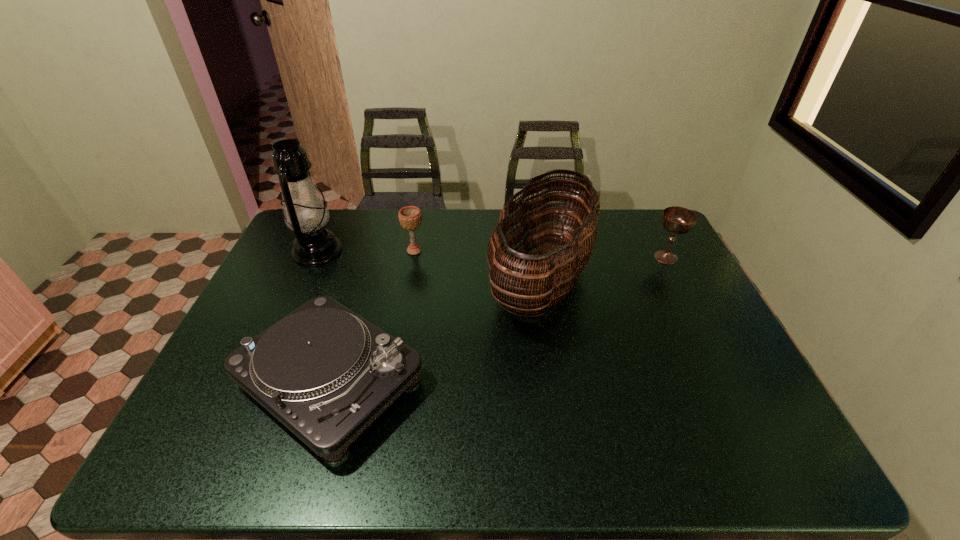
I want to click on vacant space located on the right of the shortest object, so click(x=571, y=381).

Where is `oil lamp present at the far edge`? oil lamp present at the far edge is located at coordinates (305, 212).

You are a GUI agent. You are given a task and a screenshot of the screen. Output one action in this format:
    pyautogui.click(x=<x>, y=<y>)
    Task: Click on the basket located at the far edge
    This screenshot has width=960, height=540.
    Given the screenshot: What is the action you would take?
    pyautogui.click(x=540, y=283)

Where is `object present at the near edge`? object present at the near edge is located at coordinates (326, 373).

Identify the location of oil lamp located at the left edge. (305, 212).

You are a GUI agent. You are given a task and a screenshot of the screen. Output one action in this format:
    pyautogui.click(x=<x>, y=<y>)
    Task: Click on the record player present at the left edge
    The width and height of the screenshot is (960, 540).
    Given the screenshot: What is the action you would take?
    pyautogui.click(x=326, y=373)

Identify the location of object present at the right edge. (678, 220).

Locate an element on the screen. This screenshot has height=540, width=960. object that is at the far left corner is located at coordinates (305, 212).

Find the location of `object at the near left corner`. object at the near left corner is located at coordinates (326, 373).

At what (x,y) coordinates should I click in order to perform the action: click on object at the far right corner. Please return your answer as a coordinate pair (x, y). Looking at the image, I should click on pos(678,220).